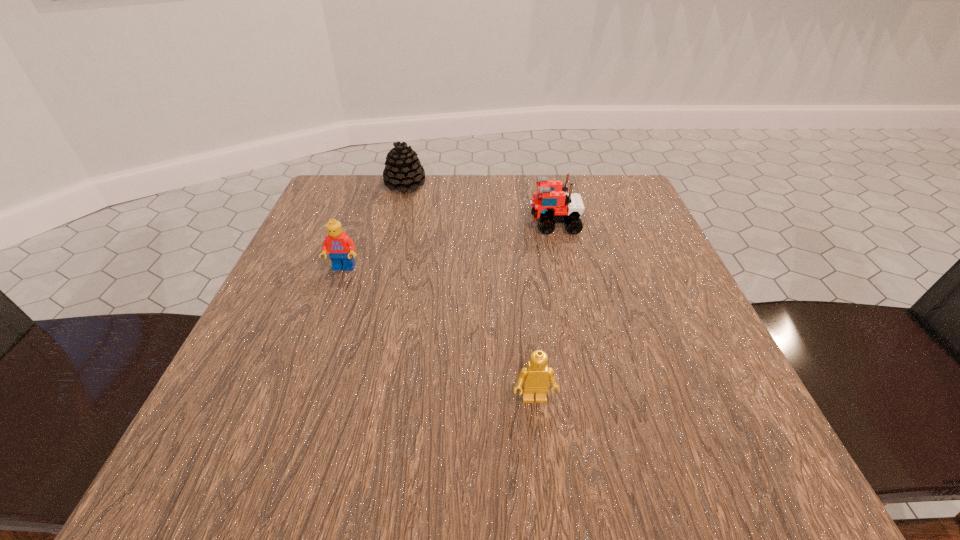
At what (x,y) coordinates should I click in order to perform the action: click on vacant region at the left edge of the desktop. Please return your answer as a coordinate pair (x, y). This screenshot has height=540, width=960. Looking at the image, I should click on (321, 244).

Identify the location of vacant region at the right edge. (732, 415).

Image resolution: width=960 pixels, height=540 pixels. I want to click on free space at the far left corner of the desktop, so click(347, 209).

At what (x,y) coordinates should I click in order to perform the action: click on vacant position at the near left corner of the desktop. Please return your answer as a coordinate pair (x, y). This screenshot has height=540, width=960. Looking at the image, I should click on (212, 450).

Find the location of a particular element. The width and height of the screenshot is (960, 540). blank space at the far right corner of the desktop is located at coordinates (596, 178).

This screenshot has width=960, height=540. Identify the location of free point between the farthest Lego and the pinecone. click(x=480, y=204).

I want to click on free space between the second nearest Lego and the nearest object, so click(x=439, y=334).

The width and height of the screenshot is (960, 540). I want to click on unoccupied area between the farthest Lego and the nearest Lego, so click(x=544, y=312).

The image size is (960, 540). I want to click on free point between the second nearest object and the pinecone, so click(374, 227).

The height and width of the screenshot is (540, 960). Identify the location of free point between the third farthest object and the nearest object. [x=439, y=334].